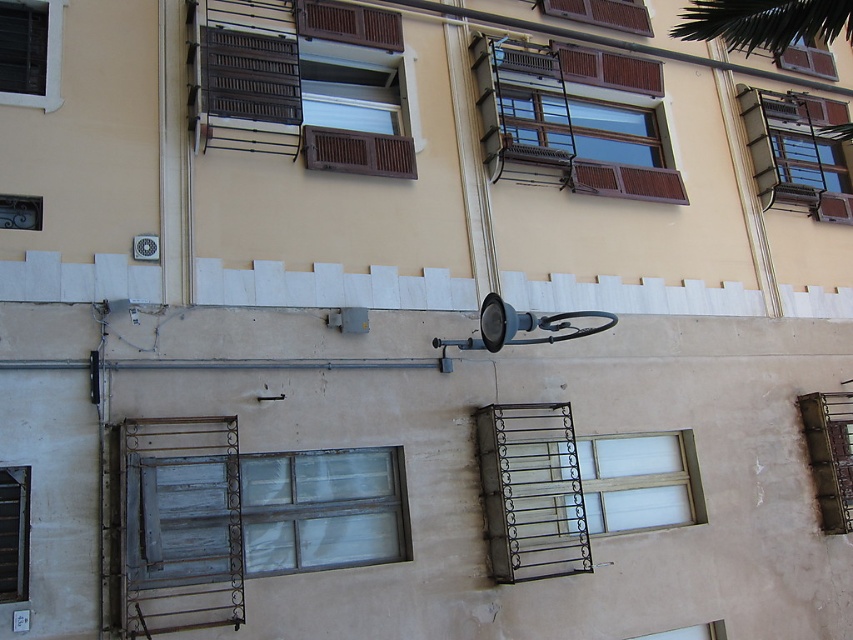
You are standing in front of the building and want to place a potted plant on the wooden balcony at upper center and the black wrought iron balcony at center. Which balcony is higher up?

The wooden balcony at upper center is located above the black wrought iron balcony at center, so it is higher up.

You are standing in front of the building and notice two balconies. The wooden balcony at upper center and the black wrought iron balcony at center. Which one is located to the right of the other?

The wooden balcony at upper center is positioned on the right side of black wrought iron balcony at center.

You are a painter who needs to decide which area to paint first. Based on the size of the black wrought iron balcony at center and the matte brown window at upper right, which object requires more paint?

The black wrought iron balcony at center requires more paint because it is larger in size than the matte brown window at upper right.